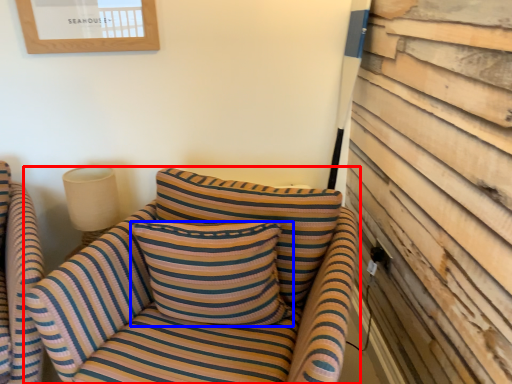
Question: Which of the following is the closest to the observer, studio couch (highlighted by a red box) or pillow (highlighted by a blue box)?

Choices:
 (A) studio couch
 (B) pillow

Answer: (A)